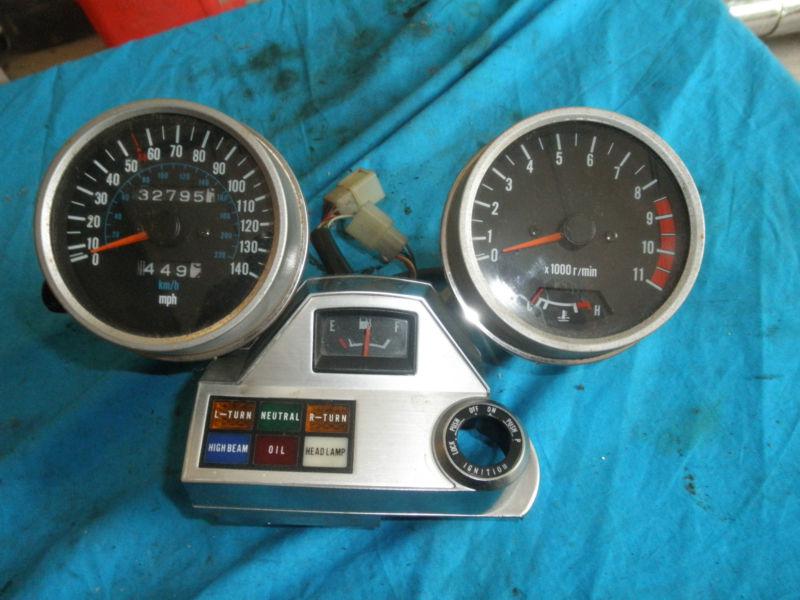
Identify the location of sheet. The height and width of the screenshot is (600, 800). (705, 506).